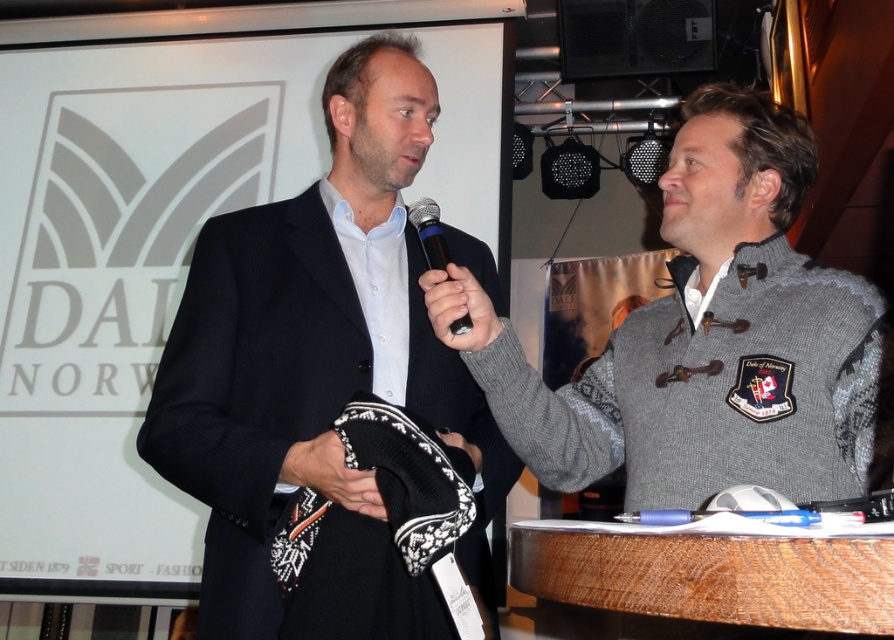
Does knitted gray sweater at center have a greater width compared to black plastic microphone at center?

Yes, knitted gray sweater at center is wider than black plastic microphone at center.

Does knitted gray sweater at center appear under black plastic microphone at center?

Correct, knitted gray sweater at center is located below black plastic microphone at center.

Is point (686, 376) in front of point (431, 240)?

That is False.

The image size is (894, 640). I want to click on knitted gray sweater at center, so click(x=704, y=337).

Is black matte suit at center in front of black plastic microphone at center?

That is True.

Which of these two, black matte suit at center or black plastic microphone at center, stands taller?

black matte suit at center is taller.

Does point (287, 285) come closer to viewer compared to point (445, 250)?

That is False.

At what (x,y) coordinates should I click in order to perform the action: click on black matte suit at center. Please return your answer as a coordinate pair (x, y). The width and height of the screenshot is (894, 640). Looking at the image, I should click on (317, 368).

Does black matte suit at center have a lesser width compared to knitted gray sweater at center?

Indeed, black matte suit at center has a lesser width compared to knitted gray sweater at center.

Consider the image. Does black matte suit at center have a greater width compared to knitted gray sweater at center?

No, black matte suit at center is not wider than knitted gray sweater at center.

The width and height of the screenshot is (894, 640). What do you see at coordinates (317, 368) in the screenshot?
I see `black matte suit at center` at bounding box center [317, 368].

You are a GUI agent. You are given a task and a screenshot of the screen. Output one action in this format:
    pyautogui.click(x=<x>, y=<y>)
    Task: Click on the black matte suit at center
    The image size is (894, 640).
    Given the screenshot: What is the action you would take?
    pyautogui.click(x=317, y=368)